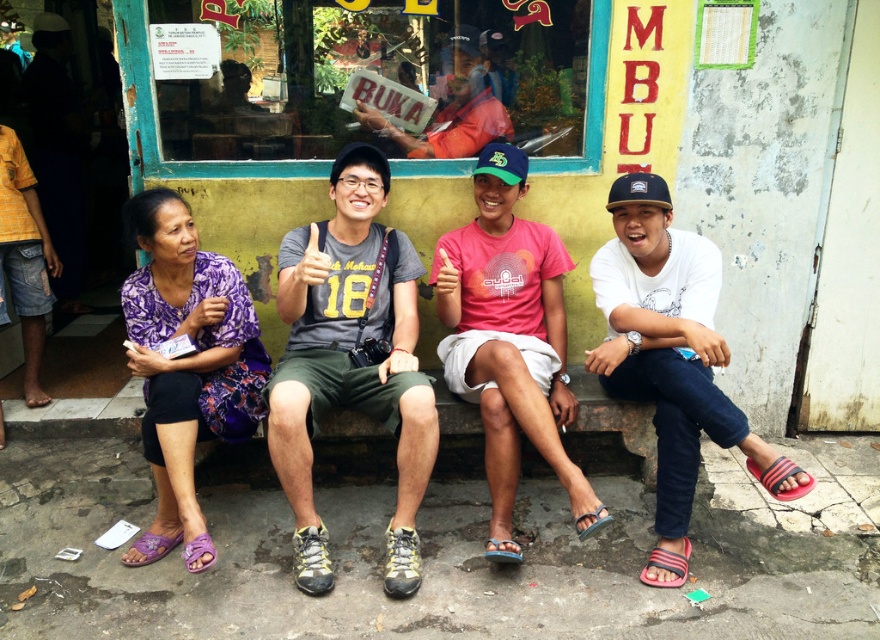
Question: Among these objects, which one is farthest from the camera?

Choices:
 (A) matte orange shirt at upper center
 (B) gray fabric shirt at center
 (C) white cotton shirt at center
 (D) purple printed dress at lower left

Answer: (A)

Question: Which point appears closest to the camera in this image?

Choices:
 (A) (525, 164)
 (B) (347, 332)

Answer: (B)

Question: Which is nearer to the pink cotton shirt at center?

Choices:
 (A) purple printed dress at lower left
 (B) white cotton shirt at center
 (C) matte orange shirt at upper center

Answer: (B)

Question: Considering the relative positions of gray fabric shirt at center and white cotton shirt at center in the image provided, where is gray fabric shirt at center located with respect to white cotton shirt at center?

Choices:
 (A) below
 (B) above

Answer: (B)

Question: Is white cotton shirt at center thinner than matte orange shirt at upper center?

Choices:
 (A) yes
 (B) no

Answer: (A)

Question: Is white cotton shirt at center below pink cotton shirt at center?

Choices:
 (A) no
 (B) yes

Answer: (B)